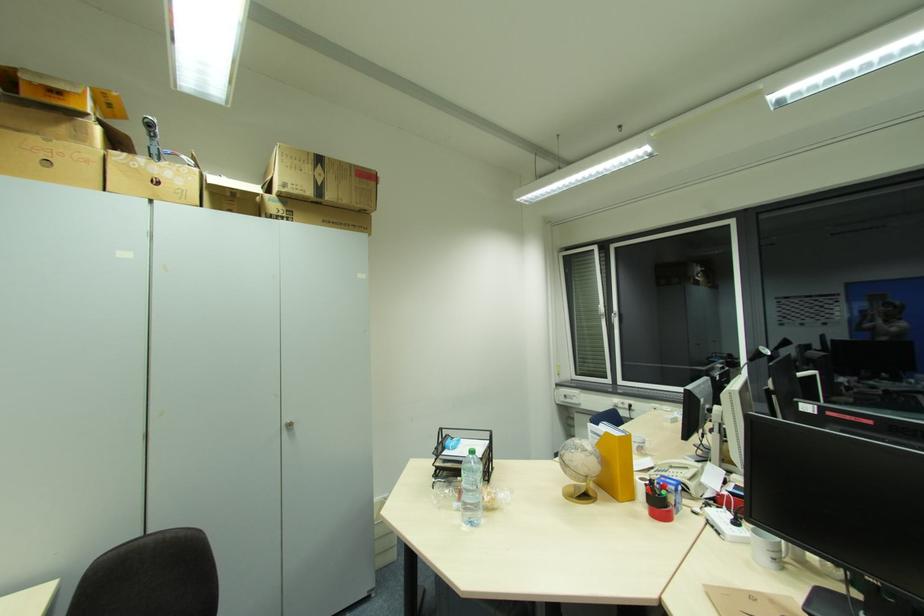
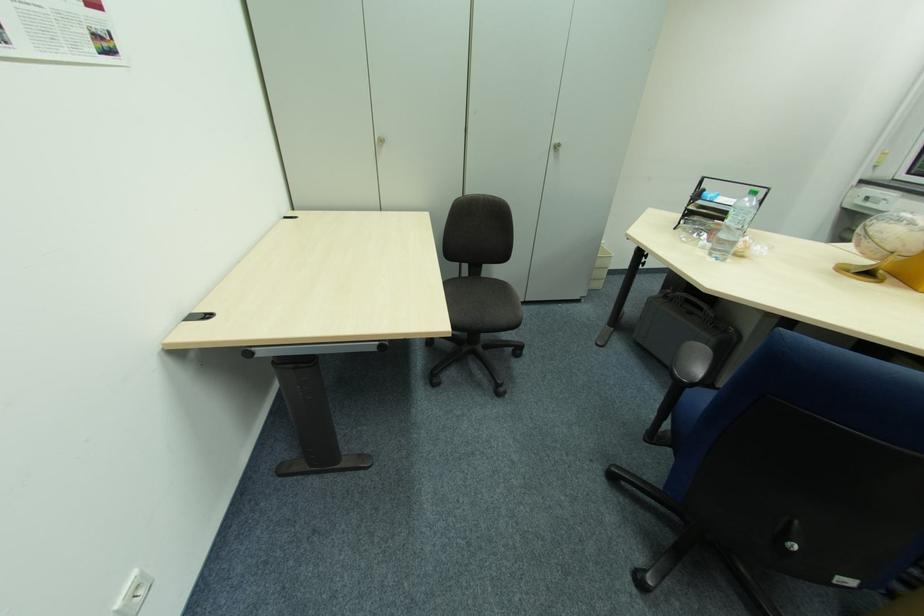
In the second image, find the point that corresponds to point (476, 485) in the first image.

(743, 224)